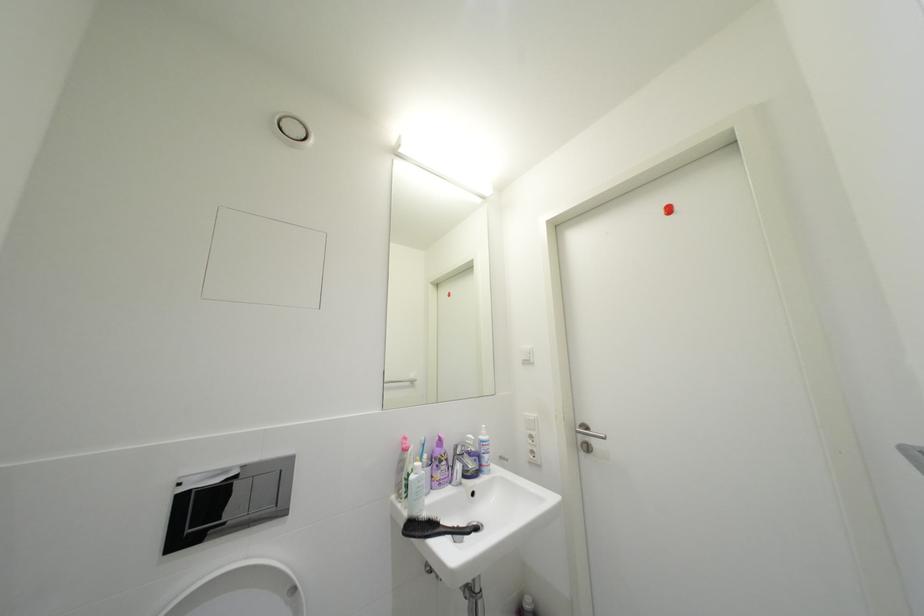
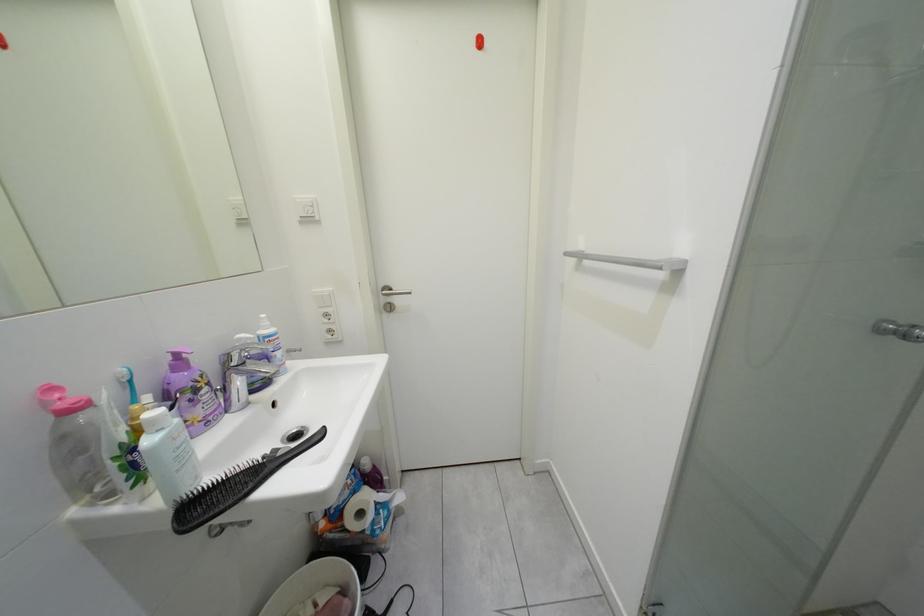
The images are taken continuously from a first-person perspective. In which direction is your viewpoint rotating?

The rotation direction of the camera is right-down.